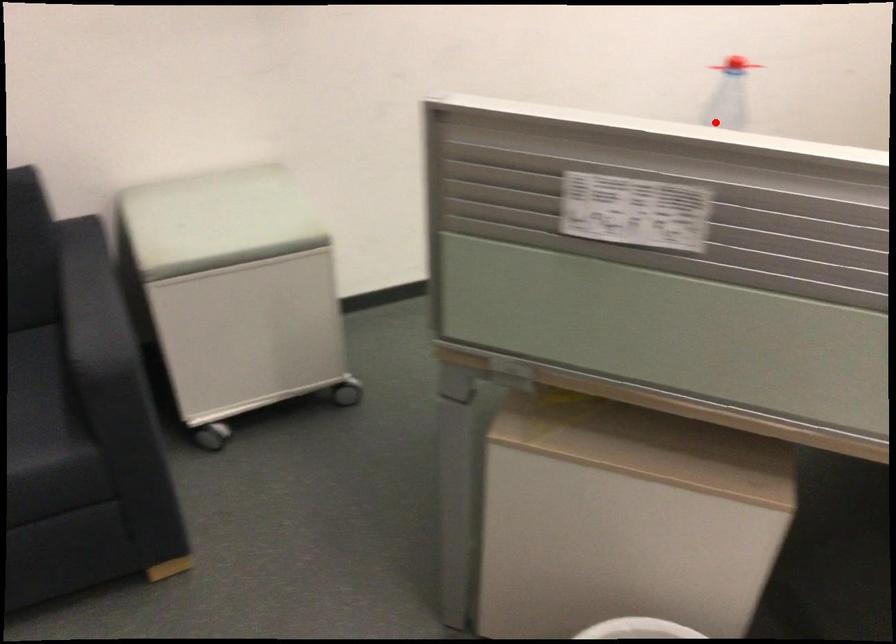
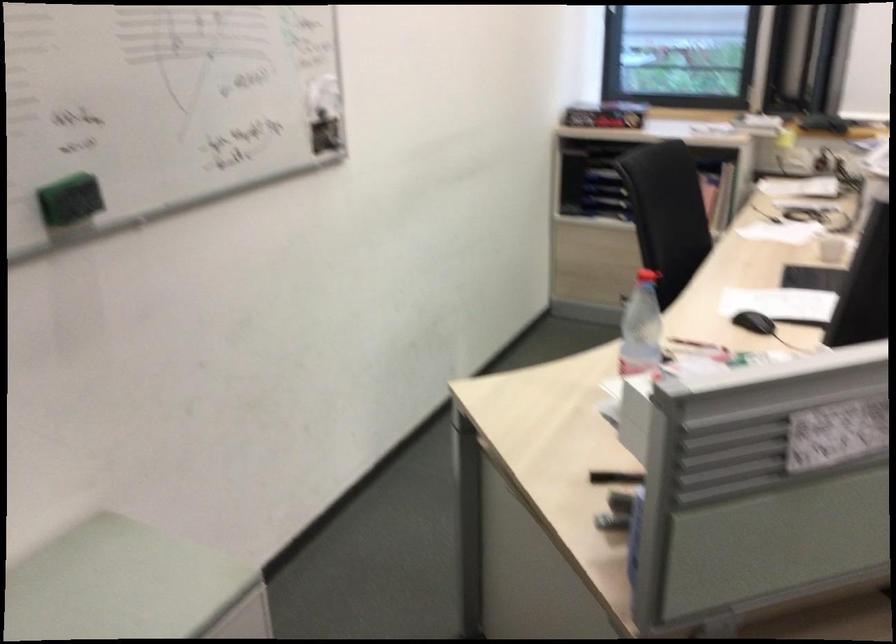
The point at the highlighted location is marked in the first image. Where is the corresponding point in the second image?

(641, 327)